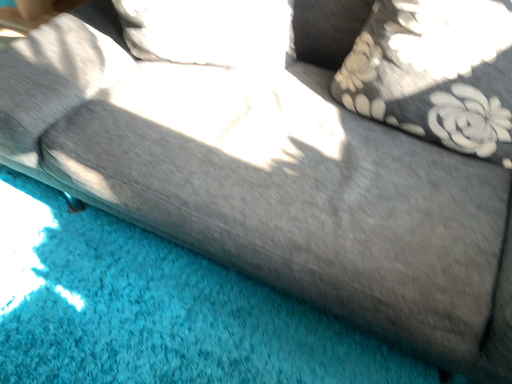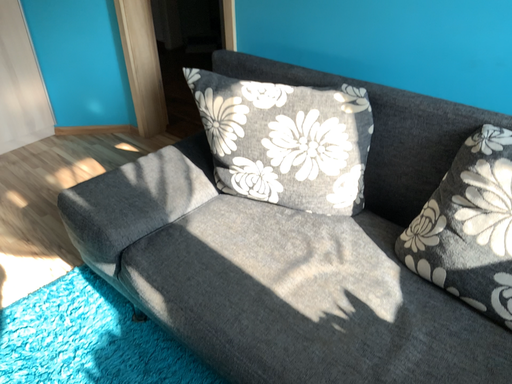
Question: How did the camera likely rotate when shooting the video?

Choices:
 (A) rotated left
 (B) rotated right

Answer: (A)